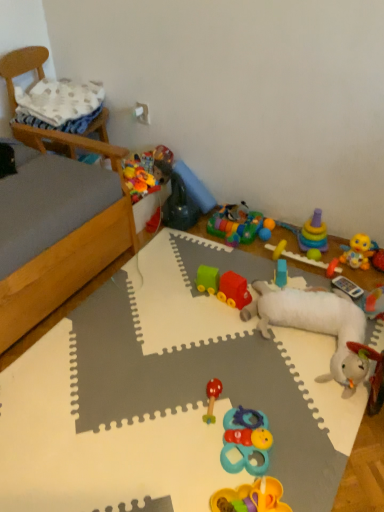
The height and width of the screenshot is (512, 384). I want to click on vacant area that lies between rubberized plastic train at center, which is counted as the 4th toy, starting from the bottom, and rubberized red mushroom at center, which is counted as the 2th toy, starting from the bottom, so click(219, 340).